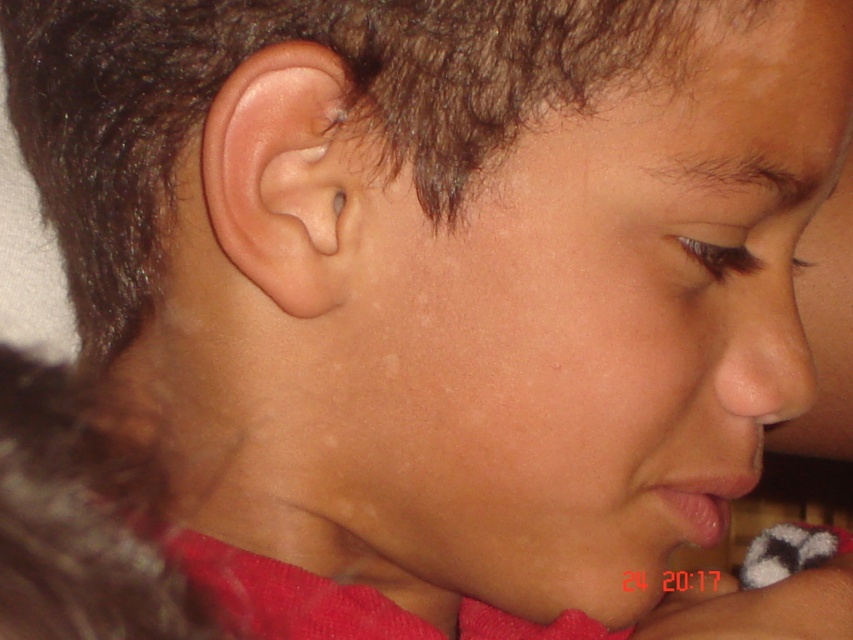
Can you confirm if pink flesh-colored ear at left is wider than dark brown hair at upper center?

Incorrect, pink flesh-colored ear at left's width does not surpass dark brown hair at upper center's.

Does point (289, 260) lie behind point (590, 17)?

That is True.

At what (x,y) coordinates should I click in order to perform the action: click on pink flesh-colored ear at left. Please return your answer as a coordinate pair (x, y). This screenshot has height=640, width=853. Looking at the image, I should click on (287, 177).

Where is `smooth skin face at center`? smooth skin face at center is located at coordinates (585, 330).

Does smooth skin face at center have a smaller size compared to dark brown hair at upper center?

No.

Where is `smooth skin face at center`? The height and width of the screenshot is (640, 853). smooth skin face at center is located at coordinates (585, 330).

Can you confirm if dark brown hair at upper center is positioned below matte skin nose at right?

Incorrect, dark brown hair at upper center is not positioned below matte skin nose at right.

Is point (581, 81) behind point (732, 330)?

No, it is not.

Where is `dark brown hair at upper center`? The image size is (853, 640). dark brown hair at upper center is located at coordinates (637, 45).